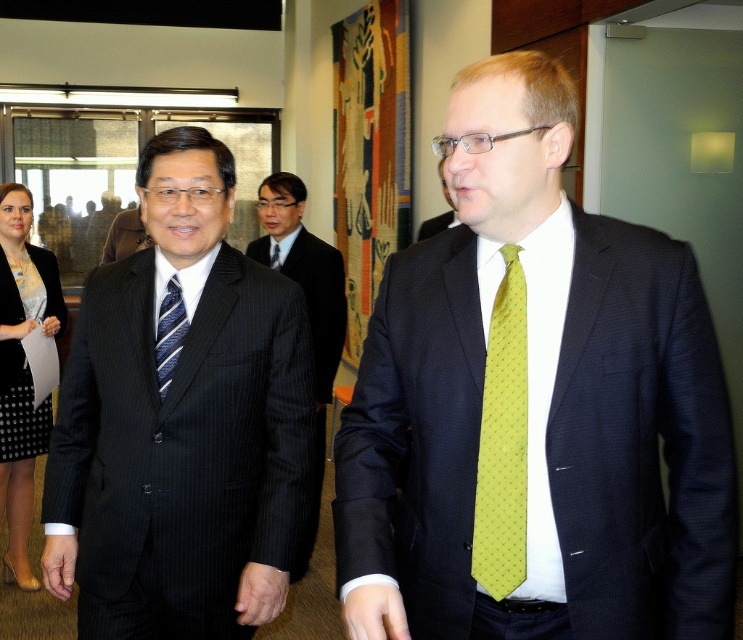
Does black pinstripe suit at center have a greater height compared to dark blue textured suit at center?

Yes.

Is black pinstripe suit at center behind dark blue textured suit at center?

Yes, it is.

Between point (140, 232) and point (441, 227), which one is positioned behind?

Point (140, 232)

Find the location of a particular element. The height and width of the screenshot is (640, 743). black pinstripe suit at center is located at coordinates (126, 236).

Between striped fabric tie at left and black pinstripe suit at center, which one appears on the left side from the viewer's perspective?

From the viewer's perspective, black pinstripe suit at center appears more on the left side.

Can you confirm if striped fabric tie at left is thinner than black pinstripe suit at center?

Indeed, striped fabric tie at left has a lesser width compared to black pinstripe suit at center.

Between point (162, 378) and point (129, 240), which one is positioned in front?

Point (162, 378)

Locate an element on the screen. The width and height of the screenshot is (743, 640). striped fabric tie at left is located at coordinates (169, 333).

Does dark pinstripe suit at center have a lesser height compared to black pinstripe suit at center?

No, dark pinstripe suit at center is not shorter than black pinstripe suit at center.

Where is `dark pinstripe suit at center`? dark pinstripe suit at center is located at coordinates (184, 424).